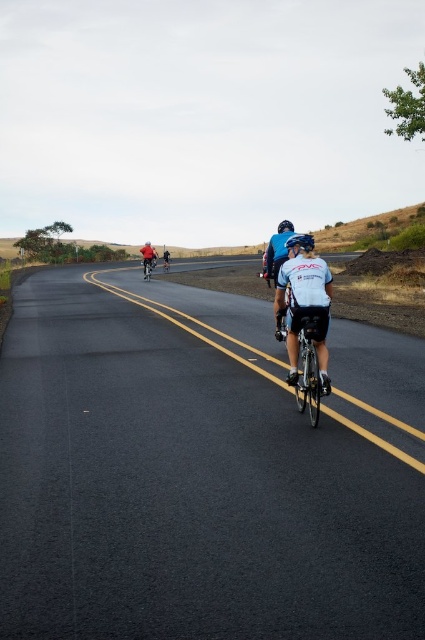
You are a pedestrian standing at the side of the road observing the cyclists. There is a matte blue helmet at center and a shiny red bicycle at center. Which object is nearer to you?

The matte blue helmet at center is closer to the viewer than the shiny red bicycle at center.

You are a photographer trying to capture a clear shot of both the white matte jersey at center and the white matte bicycle helmet at center. Since you want to ensure both are visible, which object should you focus on first to account for their sizes?

The white matte jersey at center is larger in size than the white matte bicycle helmet at center, so you should focus on the white matte jersey at center first as it takes up more space in the frame.

You are a drone operator trying to capture a photo of the white matte jersey at center from above. What coordinates should you aim for to ensure the jersey is centered in the photo?

The white matte jersey at center is located at coordinates (x=303, y=300), so aim the drone at those coordinates to center the jersey in the photo.